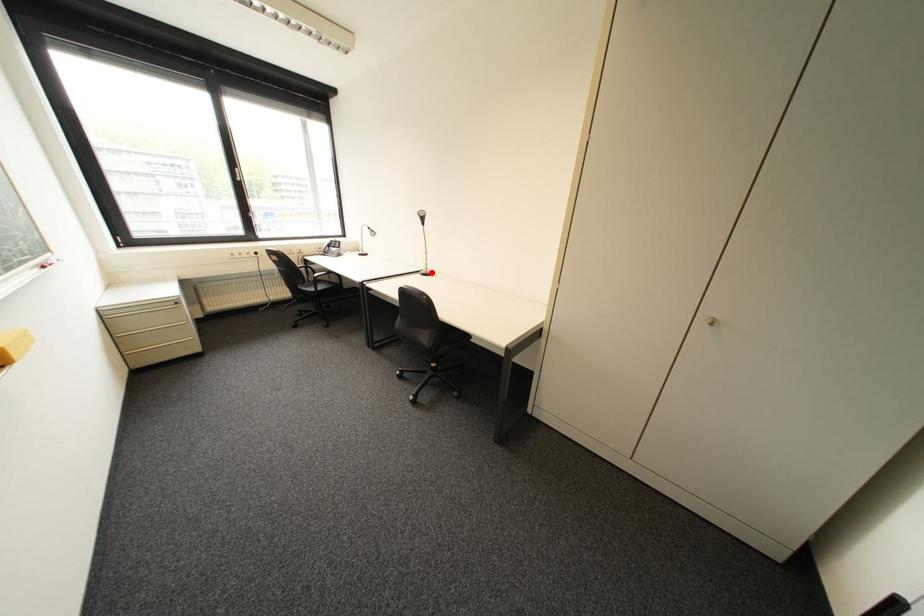
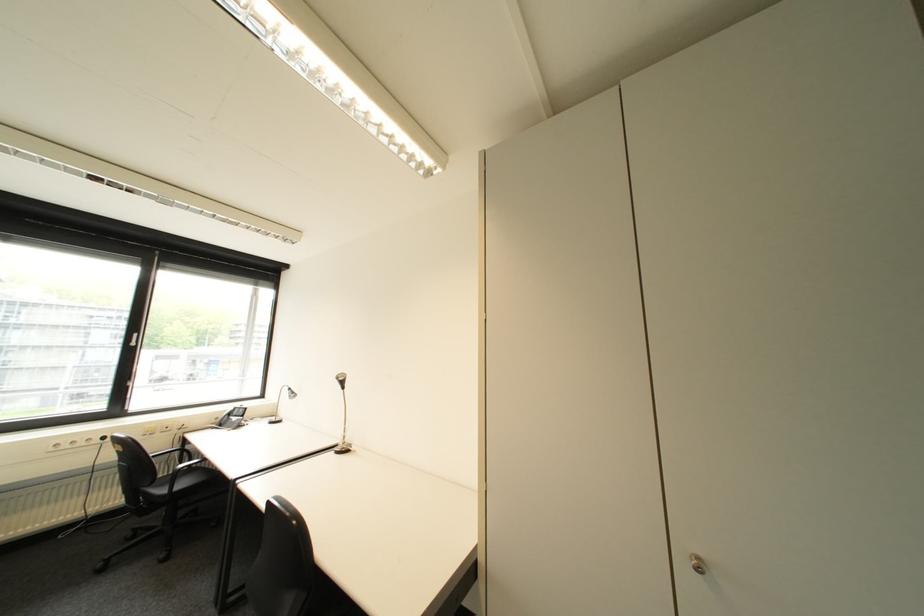
Find the pixel in the second image that matches the highlighted location in the first image.

(346, 450)